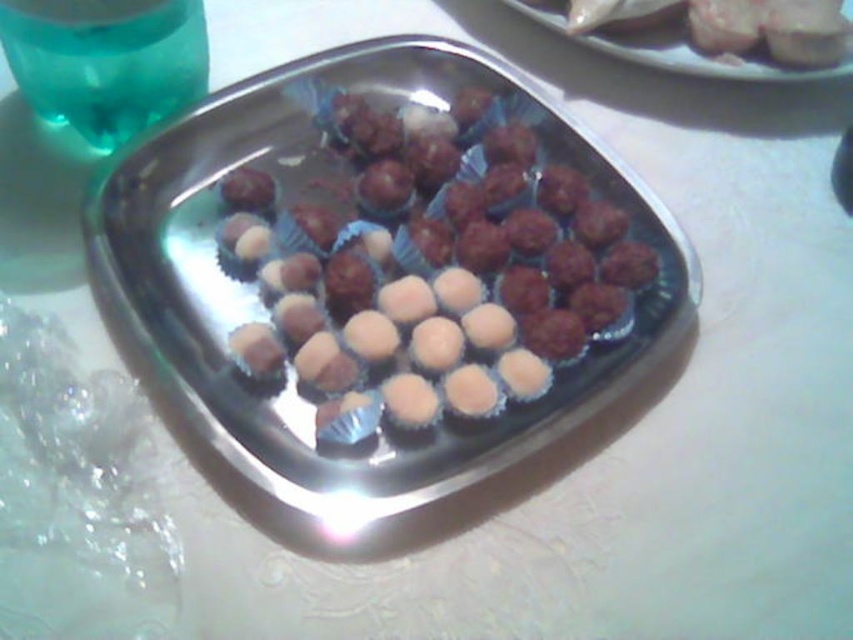
Is shiny silver tray at center positioned in front of matte silver platter at upper right?

Yes.

Is shiny silver tray at center to the left of matte silver platter at upper right from the viewer's perspective?

Indeed, shiny silver tray at center is positioned on the left side of matte silver platter at upper right.

Identify the location of shiny silver tray at center. (264, 316).